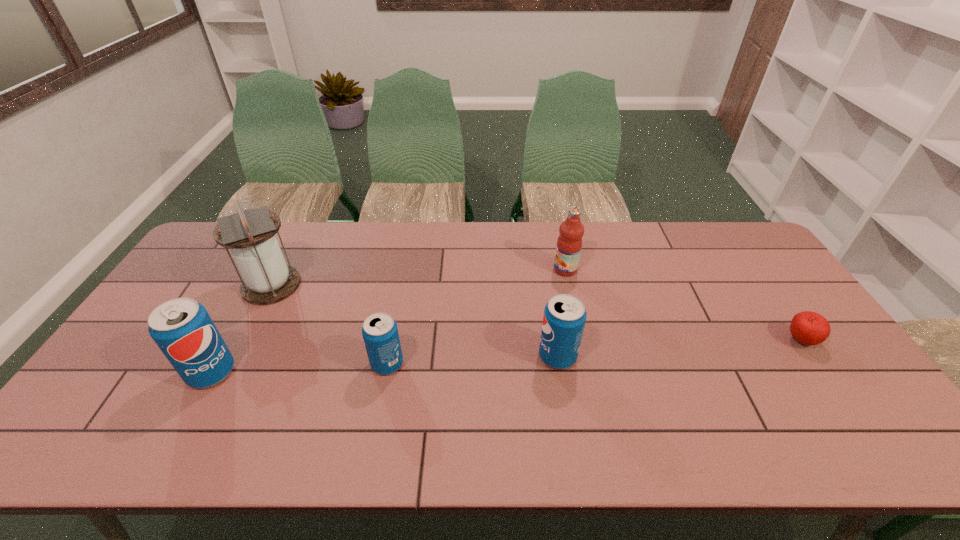
Observe the arrangement of all soda cans in the image. To keep them evenly spaced, where would you place another soda can on the right? Please locate a free space. Please provide its 2D coordinates. Your answer should be formatted as a tuple, i.e. [(x, y)], where the tuple contains the x and y coordinates of a point satisfying the conditions above.

[(722, 348)]